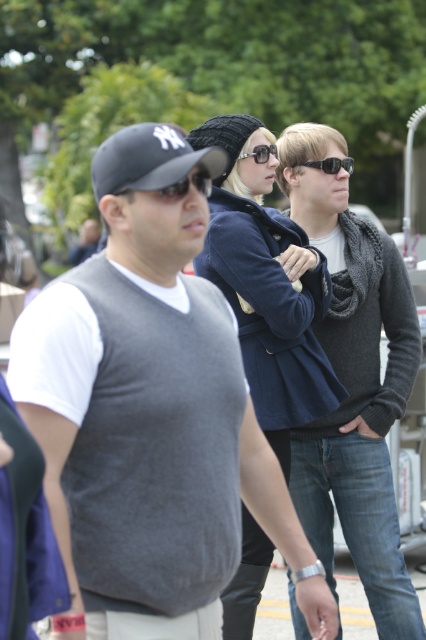
Based on the photo, you are standing in the park and see the person wearing a black baseball cap with NY written on it. There is also a dark gray matte baseball cap represented by point (149, 160). Which baseball cap is closer to you?

The dark gray matte baseball cap at center is represented by point (149, 160), so it is closer to you.

You are a photographer trying to capture a clear shot of the gray knit vest at center and the black plastic sunglasses at center. Since you want both items to appear equally sized in your photo, which object should you move closer to or farther away from the camera?

The gray knit vest at center is wider than the black plastic sunglasses at center. To make them appear the same size in the photo, you should move the gray knit vest at center farther away from the camera while bringing the black plastic sunglasses at center closer, or adjust the camera lens to compensate for their size difference.

You are standing at the camera position and want to throw a ball to the person wearing the dark blue knit sweater at center. Is the distance within a 5 meter range?

The distance between the dark blue knit sweater at center and the camera is 4.96 meters, which is within a 5 meter range. Therefore, the ball can be thrown successfully to the person wearing the dark blue knit sweater at center.